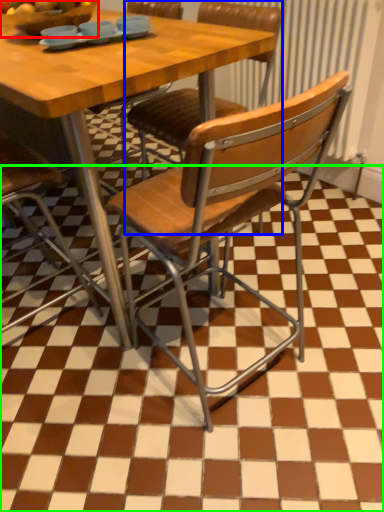
Question: Which object is the farthest from fruit dish (highlighted by a red box)? Choose among these: chair (highlighted by a blue box) or tile (highlighted by a green box).

Choices:
 (A) chair
 (B) tile

Answer: (B)